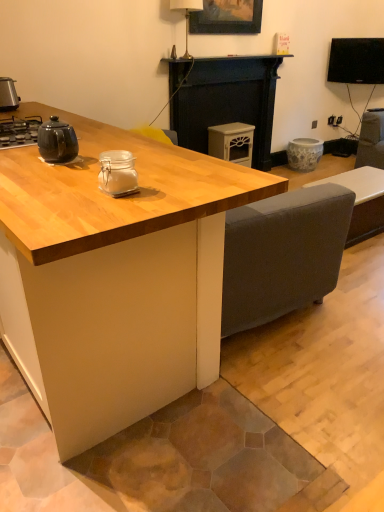
Find the location of a particular element. This screenshot has width=384, height=512. free space in front of matte black teapot at left is located at coordinates (51, 172).